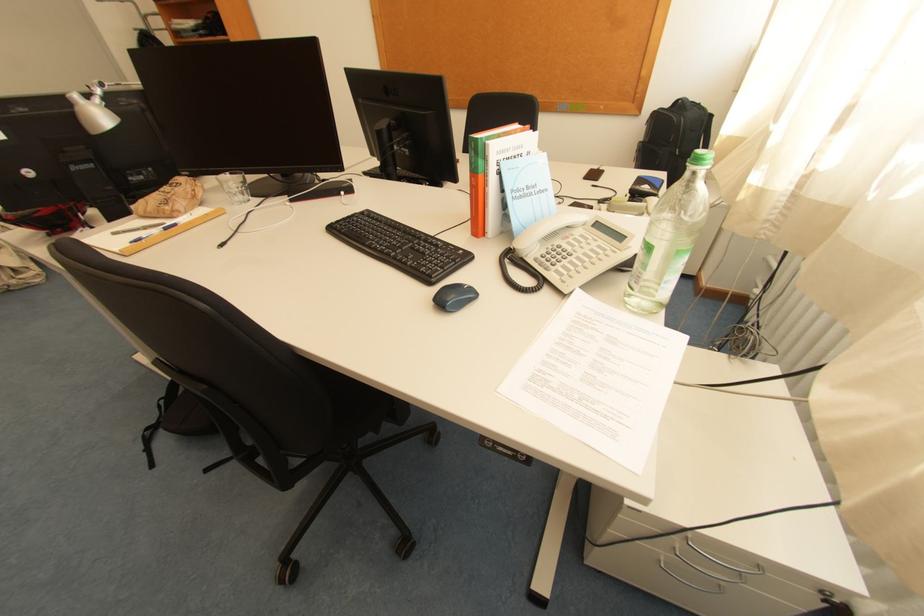
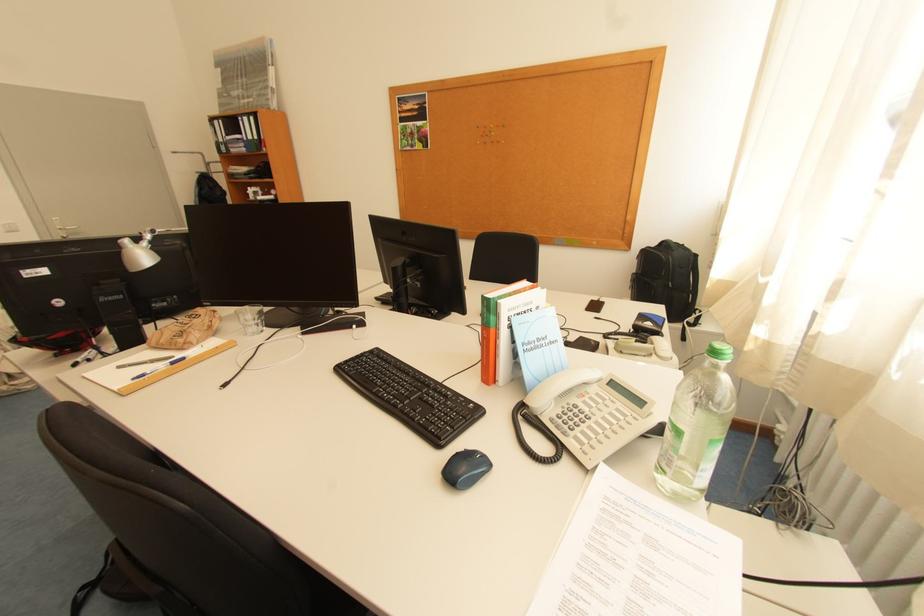
Question: In a continuous first-person perspective shot, in which direction is the camera moving?

Choices:
 (A) Left
 (B) Right
 (C) Forward
 (D) Backward

Answer: (A)